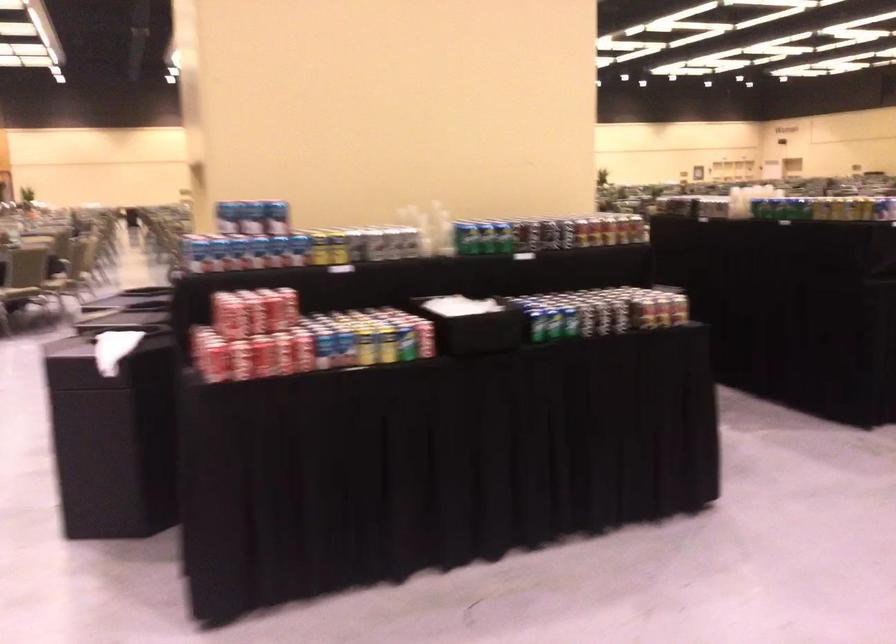
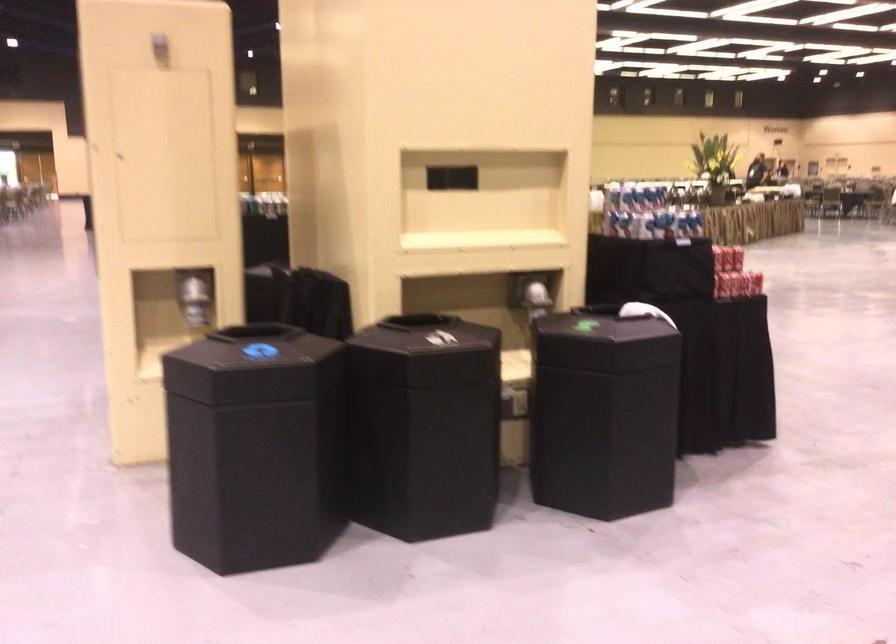
Question: I am providing you with two images of the same scene from different viewpoints. After the viewpoint changes to image2, which objects are now occluded?

Choices:
 (A) black bin lid
 (B) green soda can
 (C) silver tape dispenser
 (D) shiny dispenser lever

Answer: (B)